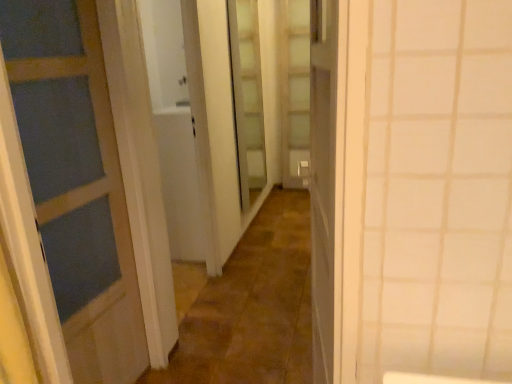
Question: Considering the relative sizes of clear glass door at center, which is counted as the 2th screen door, starting from the right, and brown stone alley at center in the image provided, is clear glass door at center, which is counted as the 2th screen door, starting from the right, wider than brown stone alley at center?

Choices:
 (A) yes
 (B) no

Answer: (B)

Question: Could you tell me if clear glass door at center, acting as the 1th screen door starting from the left, is facing brown stone alley at center?

Choices:
 (A) no
 (B) yes

Answer: (A)

Question: Is the depth of clear glass door at center, which is the first screen door from front to back, less than that of brown stone alley at center?

Choices:
 (A) no
 (B) yes

Answer: (A)

Question: From a real-world perspective, is clear glass door at center, the 2th screen door when ordered from back to front, under brown stone alley at center?

Choices:
 (A) no
 (B) yes

Answer: (A)

Question: Can you confirm if clear glass door at center, which is counted as the 2th screen door, starting from the right, is positioned to the right of brown stone alley at center?

Choices:
 (A) no
 (B) yes

Answer: (A)

Question: Is clear glass door at center, which is the first screen door from front to back, to the left of brown stone alley at center from the viewer's perspective?

Choices:
 (A) yes
 (B) no

Answer: (A)

Question: Does brown stone alley at center have a lesser height compared to clear glass door at center, acting as the 1th screen door starting from the left?

Choices:
 (A) no
 (B) yes

Answer: (B)

Question: From a real-world perspective, is brown stone alley at center physically above clear glass door at center, which is counted as the 2th screen door, starting from the right?

Choices:
 (A) yes
 (B) no

Answer: (B)

Question: Would you say brown stone alley at center is outside clear glass door at center, which is counted as the 2th screen door, starting from the right?

Choices:
 (A) no
 (B) yes

Answer: (B)

Question: Can you confirm if brown stone alley at center is positioned to the right of clear glass door at center, acting as the 1th screen door starting from the left?

Choices:
 (A) yes
 (B) no

Answer: (A)

Question: Can clear glass door at center, which is the first screen door from front to back, be found inside brown stone alley at center?

Choices:
 (A) no
 (B) yes

Answer: (A)

Question: Does brown stone alley at center have a greater width compared to clear glass door at center, which is counted as the 2th screen door, starting from the right?

Choices:
 (A) no
 (B) yes

Answer: (B)

Question: Is brown stone alley at center next to translucent glass screen door at center, which is counted as the first screen door, starting from the right, and touching it?

Choices:
 (A) yes
 (B) no

Answer: (B)